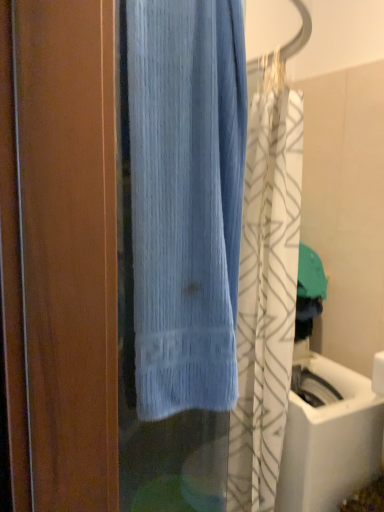
Question: Should I look upward or downward to see light blue textured towel at center?

Choices:
 (A) up
 (B) down

Answer: (B)

Question: Does light blue fabric at center have a lesser height compared to white glossy sink at lower right?

Choices:
 (A) yes
 (B) no

Answer: (A)

Question: From the image's perspective, would you say light blue fabric at center is shown under white glossy sink at lower right?

Choices:
 (A) yes
 (B) no

Answer: (B)

Question: Is light blue fabric at center positioned with its back to white glossy sink at lower right?

Choices:
 (A) no
 (B) yes

Answer: (A)

Question: Could you tell me if light blue fabric at center is turned towards white glossy sink at lower right?

Choices:
 (A) yes
 (B) no

Answer: (B)

Question: Considering the relative sizes of light blue fabric at center and white glossy sink at lower right in the image provided, is light blue fabric at center thinner than white glossy sink at lower right?

Choices:
 (A) no
 (B) yes

Answer: (B)

Question: Is the position of light blue fabric at center less distant than that of white glossy sink at lower right?

Choices:
 (A) yes
 (B) no

Answer: (A)

Question: Is light blue textured towel at center outside white glossy sink at lower right?

Choices:
 (A) no
 (B) yes

Answer: (B)

Question: From a real-world perspective, is light blue textured towel at center under white glossy sink at lower right?

Choices:
 (A) no
 (B) yes

Answer: (A)

Question: Can you confirm if light blue textured towel at center is positioned to the left of white glossy sink at lower right?

Choices:
 (A) no
 (B) yes

Answer: (B)

Question: Considering the relative positions of light blue textured towel at center and white glossy sink at lower right in the image provided, is light blue textured towel at center behind white glossy sink at lower right?

Choices:
 (A) yes
 (B) no

Answer: (B)

Question: Are light blue textured towel at center and white glossy sink at lower right making contact?

Choices:
 (A) no
 (B) yes

Answer: (A)

Question: Does light blue textured towel at center have a lesser height compared to white glossy sink at lower right?

Choices:
 (A) yes
 (B) no

Answer: (B)

Question: Does white glossy sink at lower right come behind light blue fabric at center?

Choices:
 (A) no
 (B) yes

Answer: (B)